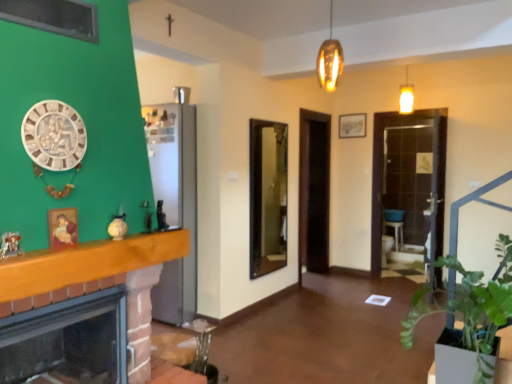
I want to click on brick fireplace at left, so click(67, 339).

What is the approximate height of brick fireplace at left?

20.26 inches.

This screenshot has height=384, width=512. What do you see at coordinates (87, 262) in the screenshot?
I see `wooden mantel at left` at bounding box center [87, 262].

Identify the location of brick fireplace at left. The width and height of the screenshot is (512, 384). pos(67,339).

From the image's perspective, which one is positioned higher, green leafy plant at lower right or matte wooden picture frame at left?

matte wooden picture frame at left is shown above in the image.

From their relative heights in the image, would you say green leafy plant at lower right is taller or shorter than matte wooden picture frame at left?

Considering their sizes, green leafy plant at lower right has more height than matte wooden picture frame at left.

What's the angular difference between green leafy plant at lower right and matte wooden picture frame at left's facing directions?

The angle between the facing direction of green leafy plant at lower right and the facing direction of matte wooden picture frame at left is 90 degrees.

Is matte wooden picture frame at left at the back of green leafy plant at lower right?

green leafy plant at lower right is not turned away from matte wooden picture frame at left.

Between point (505, 248) and point (112, 245), which one is positioned behind?

Positioned behind is point (505, 248).

Is green leafy plant at lower right not near wooden mantel at left?

Yes, green leafy plant at lower right is far from wooden mantel at left.

From the image's perspective, is green leafy plant at lower right above or below wooden mantel at left?

From the image's perspective, green leafy plant at lower right appears below wooden mantel at left.

Which of these two, green leafy plant at lower right or wooden mantel at left, is thinner?

wooden mantel at left.

Considering their positions, is wooden mantel at left located in front of or behind green leafy plant at lower right?

In the image, wooden mantel at left appears in front of green leafy plant at lower right.

Who is bigger, wooden mantel at left or green leafy plant at lower right?

green leafy plant at lower right is bigger.

Which is correct: wooden mantel at left is inside green leafy plant at lower right, or outside of it?

wooden mantel at left is located beyond the bounds of green leafy plant at lower right.

From the image's perspective, is wooden mantel at left located beneath green leafy plant at lower right?

No.

Considering the positions of point (414, 319) and point (124, 303), is point (414, 319) closer or farther from the camera than point (124, 303)?

Point (414, 319).

Would you say green leafy plant at lower right is a long distance from brick fireplace at left?

Yes, green leafy plant at lower right and brick fireplace at left are quite far apart.

Who is smaller, green leafy plant at lower right or brick fireplace at left?

brick fireplace at left is smaller.

From a real-world perspective, which object rests below the other?

brick fireplace at left, from a real-world perspective.

Looking at this image, between brick fireplace at left and green leafy plant at lower right, which one has smaller size?

Smaller between the two is brick fireplace at left.

Between brick fireplace at left and green leafy plant at lower right, which one is positioned behind?

Result: green leafy plant at lower right is behind.

Is brick fireplace at left thinner than green leafy plant at lower right?

Yes, brick fireplace at left is thinner than green leafy plant at lower right.

Looking at their sizes, would you say matte wooden picture frame at left is wider or thinner than brick fireplace at left?

matte wooden picture frame at left is thinner than brick fireplace at left.

Is matte wooden picture frame at left at the right side of brick fireplace at left?

Indeed, matte wooden picture frame at left is positioned on the right side of brick fireplace at left.

Between point (49, 227) and point (31, 318), which one is positioned in front?

The point (31, 318) is closer.

Is wooden mantel at left placed right next to brick fireplace at left?

No, wooden mantel at left is not in contact with brick fireplace at left.

From a real-world perspective, between wooden mantel at left and brick fireplace at left, who is vertically lower?

brick fireplace at left.

In the image, is wooden mantel at left positioned in front of or behind brick fireplace at left?

wooden mantel at left is positioned closer to the viewer than brick fireplace at left.

Based on their positions, is wooden mantel at left located to the left or right of brick fireplace at left?

From the image, it's evident that wooden mantel at left is to the right of brick fireplace at left.

The width and height of the screenshot is (512, 384). I want to click on houseplant below the matte wooden picture frame at left (from the image's perspective), so [470, 312].

The image size is (512, 384). In order to click on balustrade above the green leafy plant at lower right (from a real-world perspective) in this screenshot , I will do `click(87, 262)`.

Estimate the real-world distances between objects in this image. Which object is closer to brick fireplace at left, matte wooden picture frame at left or green leafy plant at lower right?

matte wooden picture frame at left lies closer to brick fireplace at left than the other object.

From the picture: Looking at the image, which one is located closer to wooden mantel at left, brick fireplace at left or matte wooden picture frame at left?

matte wooden picture frame at left lies closer to wooden mantel at left than the other object.

Based on the photo, based on their spatial positions, is wooden mantel at left or brick fireplace at left further from green leafy plant at lower right?

brick fireplace at left is further to green leafy plant at lower right.

Estimate the real-world distances between objects in this image. Which object is further from matte wooden picture frame at left, green leafy plant at lower right or wooden mantel at left?

green leafy plant at lower right.

Estimate the real-world distances between objects in this image. Which object is further from wooden mantel at left, green leafy plant at lower right or matte wooden picture frame at left?

The object further to wooden mantel at left is green leafy plant at lower right.

Consider the image. When comparing their distances from matte wooden picture frame at left, does green leafy plant at lower right or brick fireplace at left seem closer?

brick fireplace at left is closer to matte wooden picture frame at left.

From the image, which object appears to be nearer to brick fireplace at left, green leafy plant at lower right or matte wooden picture frame at left?

Based on the image, matte wooden picture frame at left appears to be nearer to brick fireplace at left.

Looking at the image, which one is located closer to green leafy plant at lower right, matte wooden picture frame at left or brick fireplace at left?

brick fireplace at left lies closer to green leafy plant at lower right than the other object.

The width and height of the screenshot is (512, 384). I want to click on balustrade located between brick fireplace at left and green leafy plant at lower right in the left-right direction, so click(87, 262).

What are the coordinates of `balustrade between matte wooden picture frame at left and brick fireplace at left in the up-down direction` in the screenshot? It's located at (87, 262).

Locate an element on the screen. picture frame between wooden mantel at left and green leafy plant at lower right is located at coordinates (62, 227).

At what (x,y) coordinates should I click in order to perform the action: click on picture frame between brick fireplace at left and green leafy plant at lower right from left to right. Please return your answer as a coordinate pair (x, y). The width and height of the screenshot is (512, 384). Looking at the image, I should click on (62, 227).